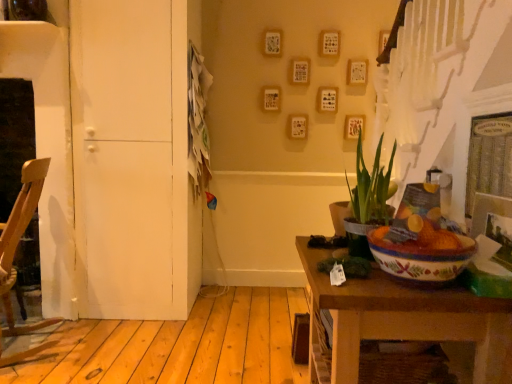
Question: From a real-world perspective, is white matte door at left positioned over wooden chair at left based on gravity?

Choices:
 (A) yes
 (B) no

Answer: (A)

Question: Does white matte door at left have a greater height compared to wooden chair at left?

Choices:
 (A) yes
 (B) no

Answer: (A)

Question: Is white matte door at left closer to camera compared to wooden chair at left?

Choices:
 (A) no
 (B) yes

Answer: (A)

Question: From the image's perspective, does white matte door at left appear higher than wooden chair at left?

Choices:
 (A) yes
 (B) no

Answer: (A)

Question: Can you confirm if white matte door at left is shorter than wooden chair at left?

Choices:
 (A) no
 (B) yes

Answer: (A)

Question: From a real-world perspective, is green leafy plant at center physically located above or below wooden chair at left?

Choices:
 (A) above
 (B) below

Answer: (A)

Question: Is green leafy plant at center situated inside wooden chair at left or outside?

Choices:
 (A) inside
 (B) outside

Answer: (B)

Question: From the image's perspective, is green leafy plant at center above or below wooden chair at left?

Choices:
 (A) above
 (B) below

Answer: (A)

Question: In terms of height, does green leafy plant at center look taller or shorter compared to wooden chair at left?

Choices:
 (A) short
 (B) tall

Answer: (A)

Question: From a real-world perspective, is white matte door at left above or below wooden table at lower right?

Choices:
 (A) above
 (B) below

Answer: (A)

Question: Looking at the image, does white matte door at left seem bigger or smaller compared to wooden table at lower right?

Choices:
 (A) big
 (B) small

Answer: (A)

Question: From the image's perspective, is white matte door at left positioned above or below wooden table at lower right?

Choices:
 (A) below
 (B) above

Answer: (B)

Question: Does point (103, 251) appear closer or farther from the camera than point (413, 324)?

Choices:
 (A) closer
 (B) farther

Answer: (B)

Question: Does point (176, 240) appear closer or farther from the camera than point (391, 170)?

Choices:
 (A) closer
 (B) farther

Answer: (B)

Question: Which is correct: white matte door at left is inside green leafy plant at center, or outside of it?

Choices:
 (A) inside
 (B) outside

Answer: (B)